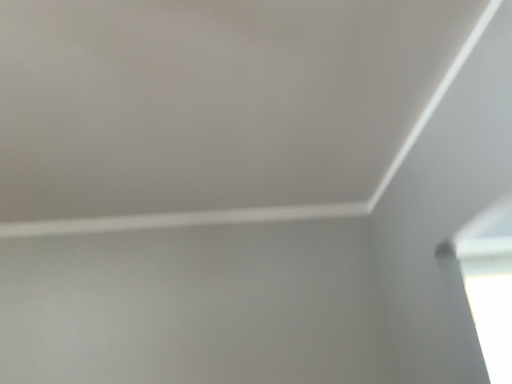
Measure the distance between point [506,342] and camera.

The depth of point [506,342] is 3.29 meters.

The image size is (512, 384). What do you see at coordinates (486, 291) in the screenshot? I see `transparent glass window at lower right` at bounding box center [486, 291].

Image resolution: width=512 pixels, height=384 pixels. Identify the location of transparent glass window at lower right. (486, 291).

Find the location of a particular element. transparent glass window at lower right is located at coordinates (486, 291).